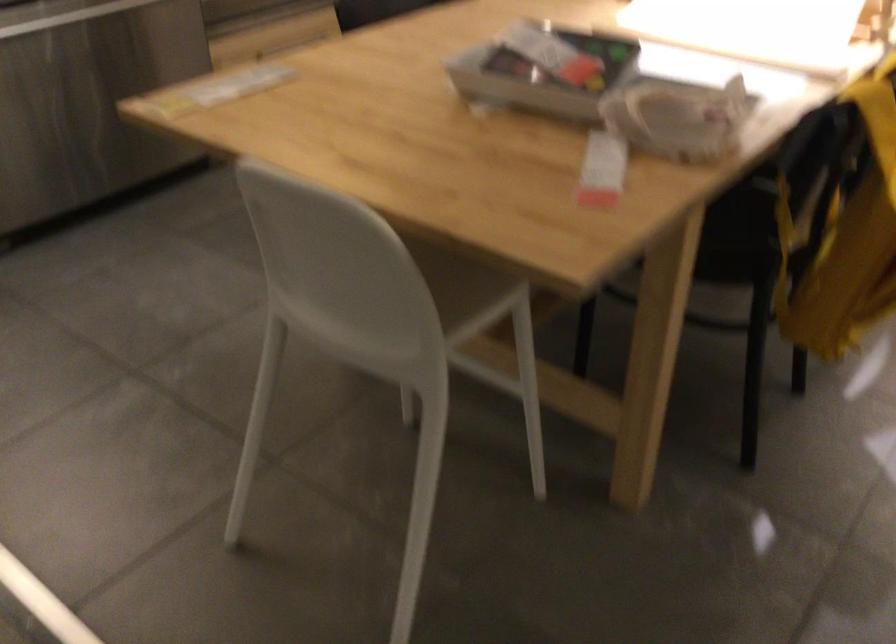
Find the location of a particular element. The image size is (896, 644). chair sitting surface is located at coordinates (468, 290).